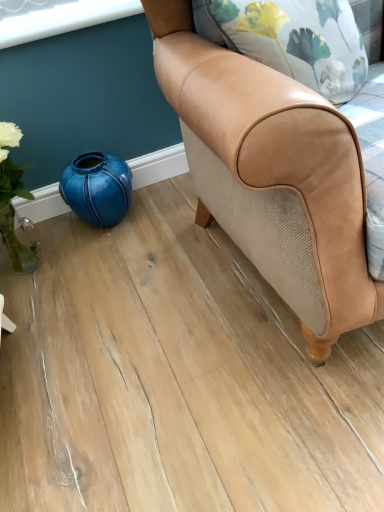
This screenshot has width=384, height=512. What do you see at coordinates (272, 175) in the screenshot? I see `tan leather chair at center` at bounding box center [272, 175].

Locate an element on the screen. The height and width of the screenshot is (512, 384). tan leather chair at center is located at coordinates (272, 175).

What is the approximate width of teal glossy vase at lower left?

8.96 inches.

This screenshot has width=384, height=512. What do you see at coordinates (97, 188) in the screenshot?
I see `teal glossy vase at lower left` at bounding box center [97, 188].

Measure the distance between teal glossy vase at lower left and camera.

They are 4.31 feet apart.

Image resolution: width=384 pixels, height=512 pixels. In order to click on teal glossy vase at lower left in this screenshot , I will do `click(97, 188)`.

Find the location of `tan leather chair at center`. tan leather chair at center is located at coordinates (272, 175).

Considering the relative positions of tan leather chair at center and teal glossy vase at lower left in the image provided, is tan leather chair at center to the left of teal glossy vase at lower left from the viewer's perspective?

No, tan leather chair at center is not to the left of teal glossy vase at lower left.

Is the depth of tan leather chair at center less than that of teal glossy vase at lower left?

Yes, the depth of tan leather chair at center is less than that of teal glossy vase at lower left.

Which is in front, point (302, 232) or point (126, 192)?

The point (302, 232) is closer to the camera.

From the image's perspective, is tan leather chair at center under teal glossy vase at lower left?

No, from the image's perspective, tan leather chair at center is not beneath teal glossy vase at lower left.

Based on the photo, from a real-world perspective, is tan leather chair at center positioned under teal glossy vase at lower left based on gravity?

No, from a real-world perspective, tan leather chair at center is not below teal glossy vase at lower left.

Looking at their sizes, would you say tan leather chair at center is wider or thinner than teal glossy vase at lower left?

tan leather chair at center is wider than teal glossy vase at lower left.

Considering the relative sizes of tan leather chair at center and teal glossy vase at lower left in the image provided, is tan leather chair at center taller than teal glossy vase at lower left?

Indeed, tan leather chair at center has a greater height compared to teal glossy vase at lower left.

Between tan leather chair at center and teal glossy vase at lower left, which one has larger size?

tan leather chair at center is bigger.

Would you say teal glossy vase at lower left is part of tan leather chair at center's contents?

No, teal glossy vase at lower left is located outside of tan leather chair at center.

Is tan leather chair at center far from teal glossy vase at lower left?

They are positioned close to each other.

Is tan leather chair at center turned away from teal glossy vase at lower left?

No, tan leather chair at center is not facing the opposite direction of teal glossy vase at lower left.

Can you tell me how much tan leather chair at center and teal glossy vase at lower left differ in facing direction?

0.000784 degrees separate the facing orientations of tan leather chair at center and teal glossy vase at lower left.

Identify the location of teal below the tan leather chair at center (from a real-world perspective). (97, 188).

Considering the positions of objects teal glossy vase at lower left and tan leather chair at center in the image provided, who is more to the left, teal glossy vase at lower left or tan leather chair at center?

From the viewer's perspective, teal glossy vase at lower left appears more on the left side.

Between teal glossy vase at lower left and tan leather chair at center, which one is positioned behind?

teal glossy vase at lower left is more distant.

Considering the positions of point (67, 172) and point (194, 127), is point (67, 172) closer or farther from the camera than point (194, 127)?

Clearly, point (67, 172) is more distant from the camera than point (194, 127).

From the image's perspective, between teal glossy vase at lower left and tan leather chair at center, which one is located above?

tan leather chair at center appears higher in the image.

From a real-world perspective, is teal glossy vase at lower left located higher than tan leather chair at center?

Incorrect, from a real-world perspective, teal glossy vase at lower left is lower than tan leather chair at center.

Based on the photo, considering the sizes of objects teal glossy vase at lower left and tan leather chair at center in the image provided, who is thinner, teal glossy vase at lower left or tan leather chair at center?

teal glossy vase at lower left is thinner.

Considering the relative sizes of teal glossy vase at lower left and tan leather chair at center in the image provided, is teal glossy vase at lower left taller than tan leather chair at center?

No.

Between teal glossy vase at lower left and tan leather chair at center, which one has larger size?

tan leather chair at center is bigger.

Would you say tan leather chair at center is part of teal glossy vase at lower left's contents?

No, teal glossy vase at lower left does not contain tan leather chair at center.

Is teal glossy vase at lower left not close to tan leather chair at center?

No, there isn't a large distance between teal glossy vase at lower left and tan leather chair at center.

Is teal glossy vase at lower left turned away from tan leather chair at center?

teal glossy vase at lower left is not turned away from tan leather chair at center.

Measure the distance between teal glossy vase at lower left and tan leather chair at center.

The distance of teal glossy vase at lower left from tan leather chair at center is 22.35 inches.

Identify the location of chair above the teal glossy vase at lower left (from a real-world perspective). (272, 175).

Find the location of a particular element. This screenshot has width=384, height=512. teal below the tan leather chair at center (from the image's perspective) is located at coordinates (97, 188).

What are the coordinates of `teal located underneath the tan leather chair at center (from a real-world perspective)` in the screenshot? It's located at (97, 188).